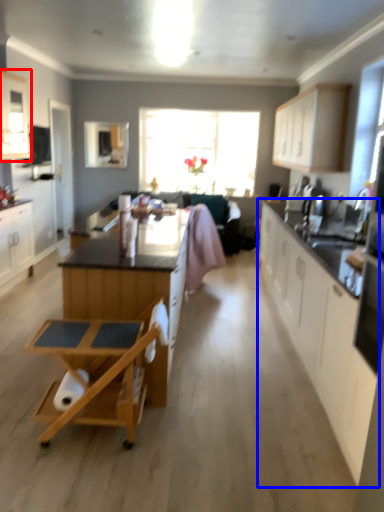
Question: Which object appears closest to the camera in this image, cabinetry (highlighted by a red box) or cabinetry (highlighted by a blue box)?

Choices:
 (A) cabinetry
 (B) cabinetry

Answer: (B)